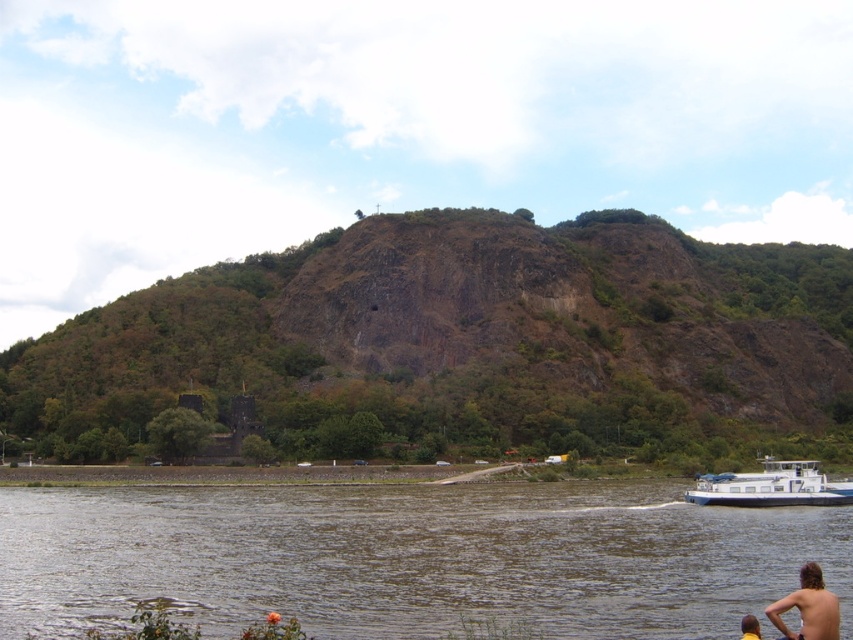
Is point (642, 317) less distant than point (184, 596)?

No, (642, 317) is further to viewer.

Between brown rocky hillside at center and brown water at lower center, which one is positioned higher?

brown rocky hillside at center is higher up.

Which is in front, point (138, 380) or point (180, 492)?

Point (180, 492) is in front.

You are a GUI agent. You are given a task and a screenshot of the screen. Output one action in this format:
    pyautogui.click(x=<x>, y=<y>)
    Task: Click on the brown rocky hillside at center
    Image resolution: width=853 pixels, height=640 pixels.
    Given the screenshot: What is the action you would take?
    pyautogui.click(x=463, y=342)

Is point (729, 557) farther from viewer compared to point (828, 608)?

Yes, point (729, 557) is behind point (828, 608).

Locate an element on the screen. The height and width of the screenshot is (640, 853). brown water at lower center is located at coordinates tap(410, 557).

Where is `brown water at lower center`? brown water at lower center is located at coordinates (410, 557).

Does brown water at lower center have a greater width compared to white matte barge at lower right?

Correct, the width of brown water at lower center exceeds that of white matte barge at lower right.

Is brown water at lower center behind white matte barge at lower right?

No, it is not.

In order to click on brown water at lower center in this screenshot , I will do `click(410, 557)`.